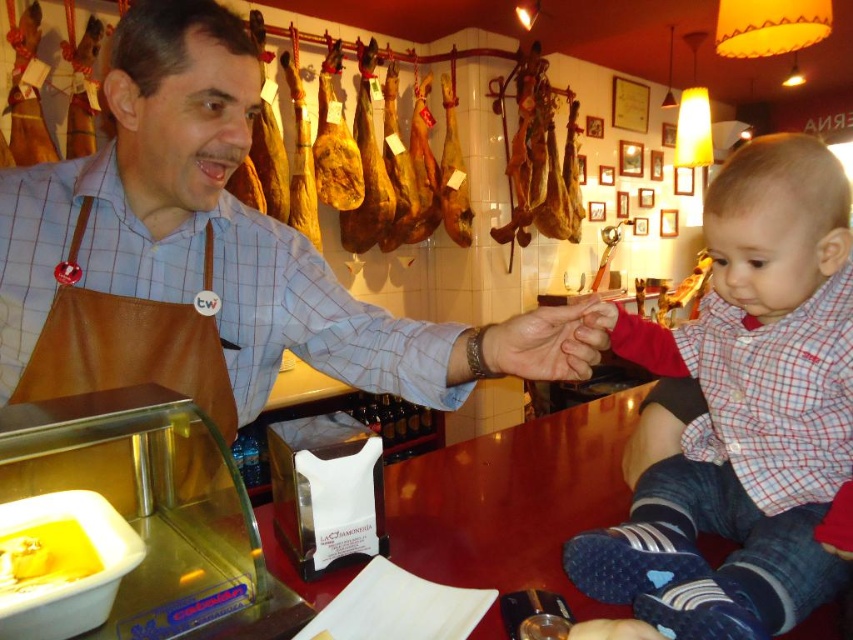
Does point (573, 340) lie in front of point (33, 561)?

No, it is not.

Between dry skin at center and yellow creamy cheese at lower left, which one is positioned lower?

yellow creamy cheese at lower left is lower down.

Which is behind, point (572, 358) or point (70, 525)?

Point (572, 358)

This screenshot has height=640, width=853. Find the location of `dry skin at center`. dry skin at center is located at coordinates (549, 340).

Looking at this image, who is higher up, checkered fabric shirt at right or yellow creamy cheese at lower left?

checkered fabric shirt at right is higher up.

Can you confirm if checkered fabric shirt at right is positioned to the right of yellow creamy cheese at lower left?

Yes, checkered fabric shirt at right is to the right of yellow creamy cheese at lower left.

Who is more distant from viewer, (751, 225) or (16, 588)?

Positioned behind is point (751, 225).

Identify the location of checkered fabric shirt at right. (744, 410).

Is brown leather apron at center bigger than yellow creamy cheese at lower left?

Yes, brown leather apron at center is bigger than yellow creamy cheese at lower left.

Which is behind, point (144, 13) or point (35, 545)?

Point (144, 13)

The width and height of the screenshot is (853, 640). I want to click on brown leather apron at center, so click(190, 248).